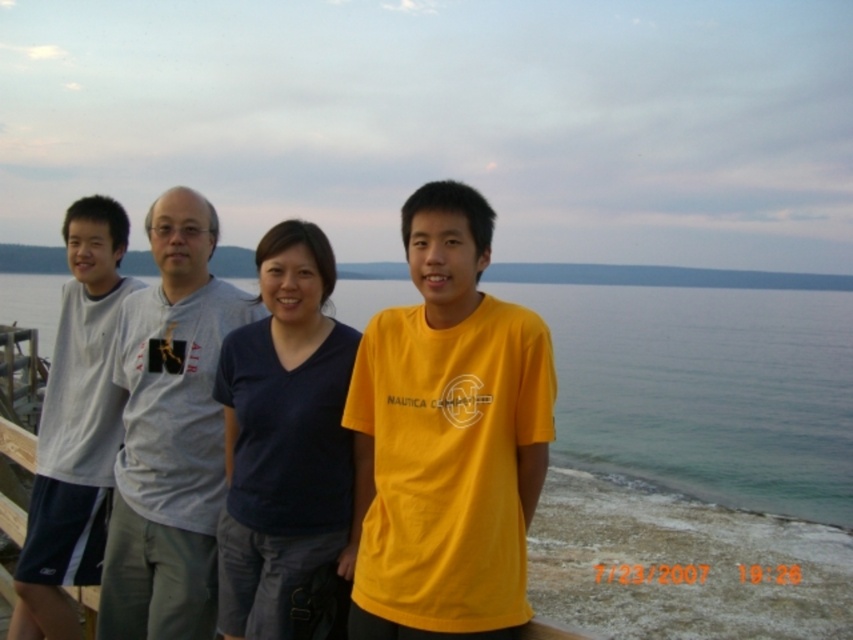
Consider the image. Does yellow cotton t-shirt at center appear on the left side of gray cotton t-shirt at center?

Incorrect, yellow cotton t-shirt at center is not on the left side of gray cotton t-shirt at center.

Does yellow cotton t-shirt at center have a lesser width compared to gray cotton t-shirt at center?

No, yellow cotton t-shirt at center is not thinner than gray cotton t-shirt at center.

Describe the element at coordinates (450, 436) in the screenshot. The image size is (853, 640). I see `yellow cotton t-shirt at center` at that location.

Image resolution: width=853 pixels, height=640 pixels. Identify the location of yellow cotton t-shirt at center. (450, 436).

Can you confirm if clear blue water at lower center is taller than dark blue fabric shirt at center?

Yes, clear blue water at lower center is taller than dark blue fabric shirt at center.

Which is behind, point (659, 456) or point (283, 364)?

The point (659, 456) is more distant.

Find the location of a particular element. This screenshot has height=640, width=853. clear blue water at lower center is located at coordinates (705, 390).

Where is `clear blue water at lower center`? clear blue water at lower center is located at coordinates (705, 390).

Is dark blue fabric shirt at center to the right of yellow matte shirt at center from the viewer's perspective?

Yes, dark blue fabric shirt at center is to the right of yellow matte shirt at center.

Is point (228, 352) positioned in front of point (260, 262)?

That is False.

At what (x,y) coordinates should I click in order to perform the action: click on dark blue fabric shirt at center. Please return your answer as a coordinate pair (x, y). This screenshot has height=640, width=853. Looking at the image, I should click on click(x=283, y=438).